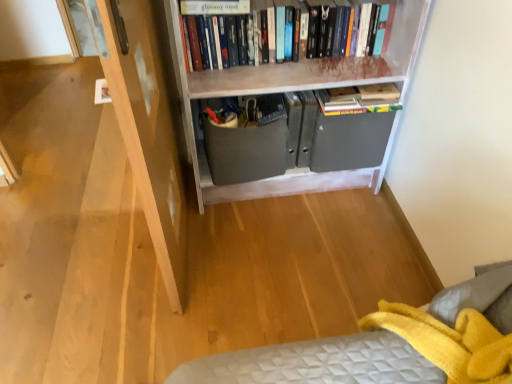
Question: From a real-world perspective, is hardcover books at upper center positioned over white painted wood bookcase at upper center based on gravity?

Choices:
 (A) no
 (B) yes

Answer: (B)

Question: From the image's perspective, does hardcover books at upper center appear higher than white painted wood bookcase at upper center?

Choices:
 (A) no
 (B) yes

Answer: (B)

Question: From a real-world perspective, is hardcover books at upper center beneath white painted wood bookcase at upper center?

Choices:
 (A) yes
 (B) no

Answer: (B)

Question: Is hardcover books at upper center looking in the opposite direction of white painted wood bookcase at upper center?

Choices:
 (A) no
 (B) yes

Answer: (B)

Question: Is hardcover books at upper center to the left of white painted wood bookcase at upper center from the viewer's perspective?

Choices:
 (A) yes
 (B) no

Answer: (A)

Question: Does hardcover books at upper center have a greater height compared to white painted wood bookcase at upper center?

Choices:
 (A) no
 (B) yes

Answer: (A)

Question: Could you tell me if hardcover book at upper center is facing matte gray drawer at center?

Choices:
 (A) no
 (B) yes

Answer: (A)

Question: Considering the relative positions of hardcover book at upper center and matte gray drawer at center in the image provided, is hardcover book at upper center to the right of matte gray drawer at center from the viewer's perspective?

Choices:
 (A) yes
 (B) no

Answer: (B)

Question: Can you confirm if hardcover book at upper center is wider than matte gray drawer at center?

Choices:
 (A) no
 (B) yes

Answer: (A)

Question: Does hardcover book at upper center lie behind matte gray drawer at center?

Choices:
 (A) no
 (B) yes

Answer: (A)

Question: Is matte gray drawer at center at the back of hardcover book at upper center?

Choices:
 (A) no
 (B) yes

Answer: (A)

Question: From a real-world perspective, does hardcover book at upper center stand above matte gray drawer at center?

Choices:
 (A) yes
 (B) no

Answer: (A)

Question: Is hardcover book at upper center oriented towards hardcover books at upper center?

Choices:
 (A) yes
 (B) no

Answer: (B)